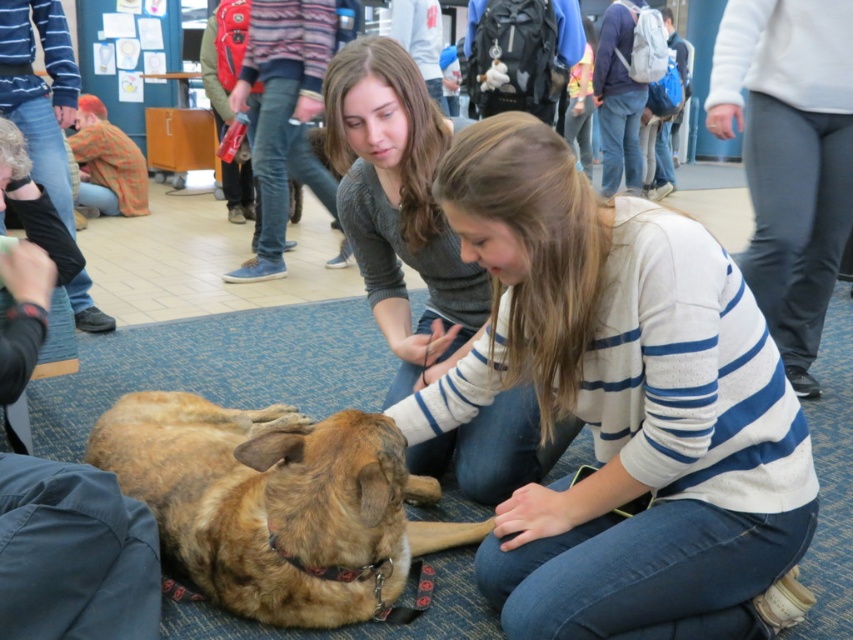
Is brown fur dog at center positioned behind brown fur dog at lower left?

Yes, it is behind brown fur dog at lower left.

Identify the location of brown fur dog at center. (276, 502).

Who is more forward, [132,481] or [32,358]?

Point [32,358]

At what (x,y) coordinates should I click in order to perform the action: click on brown fur dog at center. Please return your answer as a coordinate pair (x, y). This screenshot has width=853, height=640. Looking at the image, I should click on click(276, 502).

Measure the distance from striped sweater at center to gray sweater at center.

21.08 inches

Who is positioned more to the left, striped sweater at center or gray sweater at center?

gray sweater at center

This screenshot has width=853, height=640. Find the location of `striped sweater at center`. striped sweater at center is located at coordinates (619, 403).

I want to click on striped sweater at center, so click(x=619, y=403).

Between brown fur dog at center and gray sweater at center, which one is positioned lower?

Positioned lower is brown fur dog at center.

Does brown fur dog at center appear over gray sweater at center?

No.

Who is more forward, (x=242, y=420) or (x=465, y=275)?

Point (x=242, y=420) is in front.

Find the location of a particular element. This screenshot has width=853, height=640. brown fur dog at center is located at coordinates click(x=276, y=502).